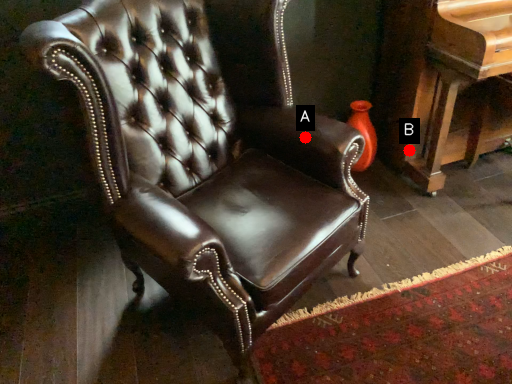
Question: Two points are circled on the image, labeled by A and B beside each circle. Which of the following is the farthest from the observer?

Choices:
 (A) A is further
 (B) B is further

Answer: (B)